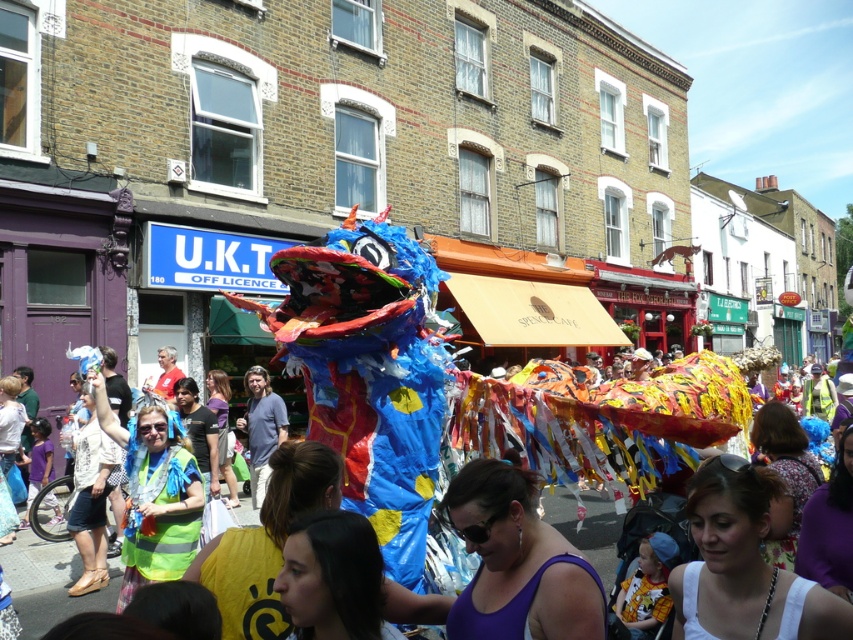
Question: Does purple fabric at center have a larger size compared to colorful paper dragon at center?

Choices:
 (A) yes
 (B) no

Answer: (B)

Question: Is purple fabric at center further to the viewer compared to colorful paper dragon at center?

Choices:
 (A) no
 (B) yes

Answer: (A)

Question: Which point appears farthest from the camera in this image?

Choices:
 (A) (589, 556)
 (B) (482, 476)

Answer: (A)

Question: Is purple fabric at center below colorful paper dragon at center?

Choices:
 (A) yes
 (B) no

Answer: (B)

Question: Which of the following is the farthest from the observer?

Choices:
 (A) purple fabric at center
 (B) colorful paper dragon at center

Answer: (B)

Question: Which point appears farthest from the camera in this image?

Choices:
 (A) (102, 593)
 (B) (503, 588)

Answer: (A)